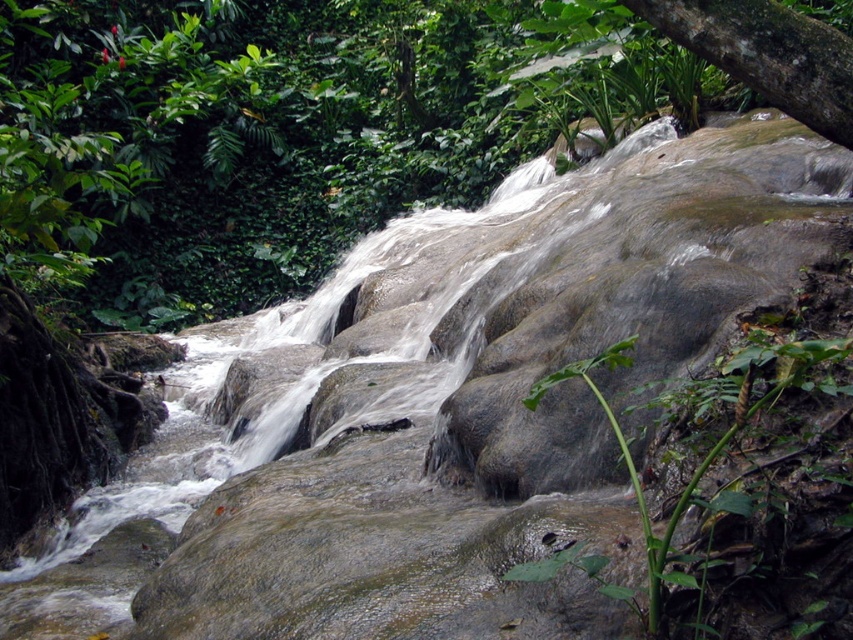
Question: In this image, where is green rough bark tree at upper right located relative to green leafy plant at lower center?

Choices:
 (A) right
 (B) left

Answer: (A)

Question: Which of the following is the farthest from the observer?

Choices:
 (A) green leafy plant at lower center
 (B) green rough bark tree at upper right

Answer: (B)

Question: Considering the relative positions of green rough bark tree at upper right and green leafy plant at lower center in the image provided, where is green rough bark tree at upper right located with respect to green leafy plant at lower center?

Choices:
 (A) left
 (B) right

Answer: (B)

Question: Is green rough bark tree at upper right to the right of green leafy plant at lower center from the viewer's perspective?

Choices:
 (A) no
 (B) yes

Answer: (B)